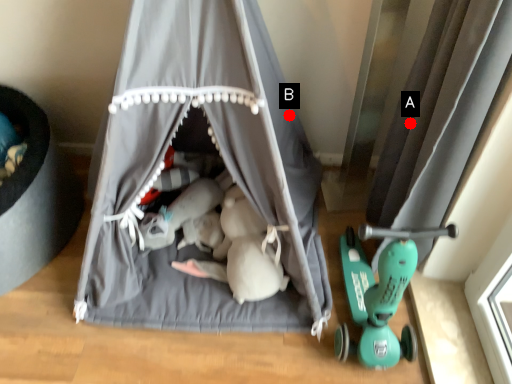
Question: Two points are circled on the image, labeled by A and B beside each circle. Which point is closer to the camera?

Choices:
 (A) A is closer
 (B) B is closer

Answer: (A)